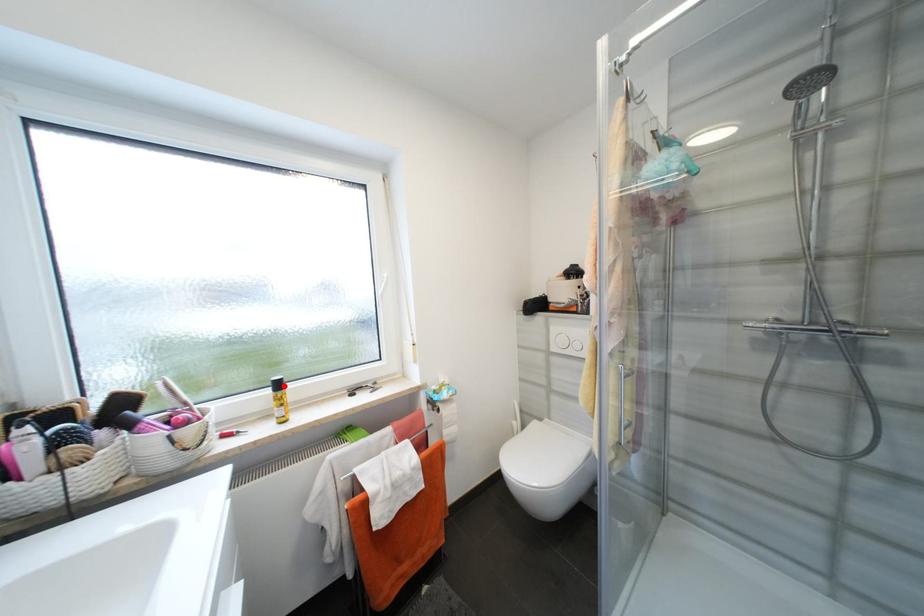
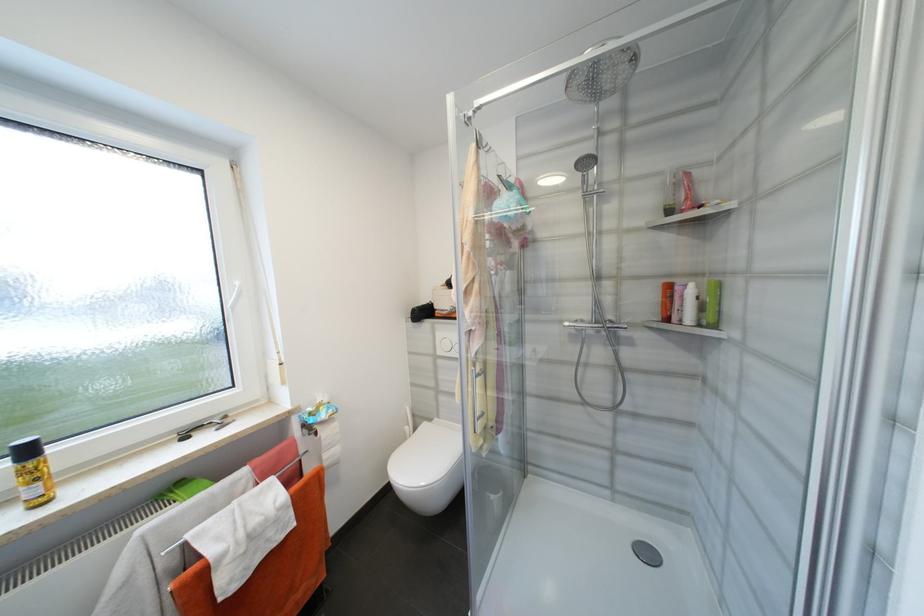
In the second image, find the point that corresponds to the highlighted location in the first image.

(33, 453)